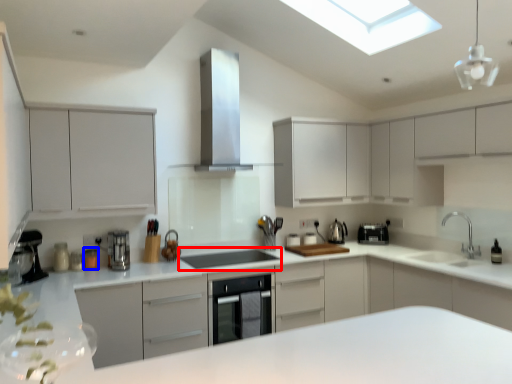
Question: Which object is further to the camera taking this photo, appliance (highlighted by a red box) or appliance (highlighted by a blue box)?

Choices:
 (A) appliance
 (B) appliance

Answer: (B)